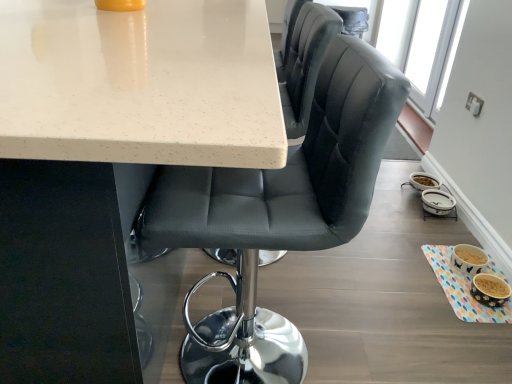
Question: From a real-world perspective, relative to transparent glass window screen at upper right, is matte black chair at center vertically above or below?

Choices:
 (A) above
 (B) below

Answer: (A)

Question: Is matte black chair at center taller or shorter than transparent glass window screen at upper right?

Choices:
 (A) tall
 (B) short

Answer: (A)

Question: Based on their relative distances, which object is nearer to the matte black chair at center?

Choices:
 (A) white speckled laminate table at upper center
 (B) transparent glass window screen at upper right

Answer: (A)

Question: Estimate the real-world distances between objects in this image. Which object is closer to the matte black chair at center?

Choices:
 (A) white speckled laminate table at upper center
 (B) transparent glass window screen at upper right

Answer: (A)